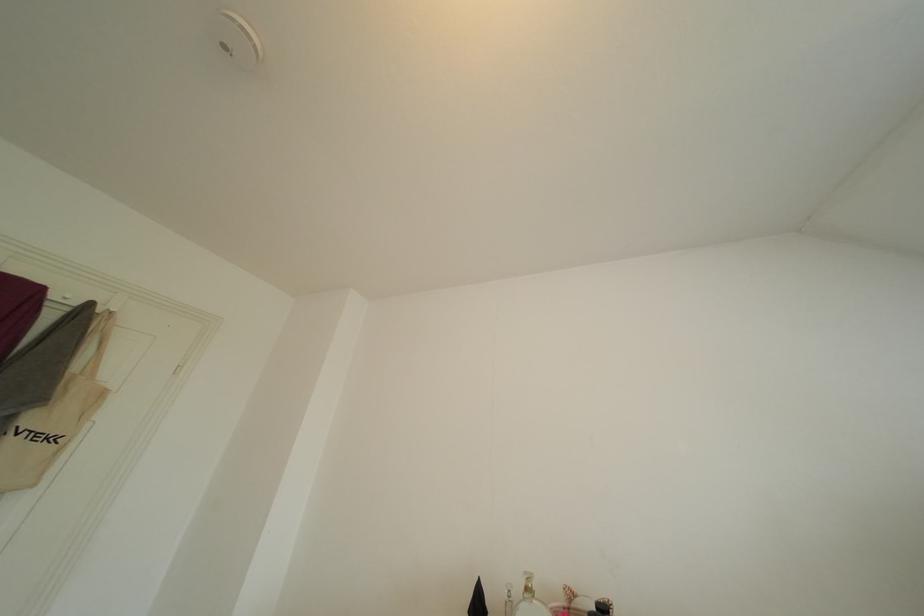
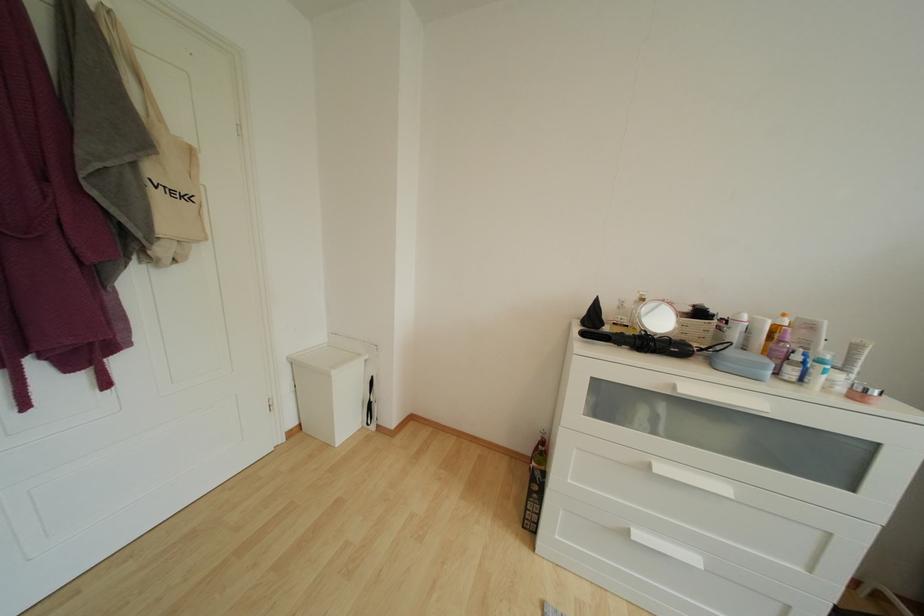
Question: Based on the continuous images, in which direction is the camera rotating? Reply with the corresponding letter.

Choices:
 (A) Left
 (B) Right
 (C) Up
 (D) Down

Answer: (D)